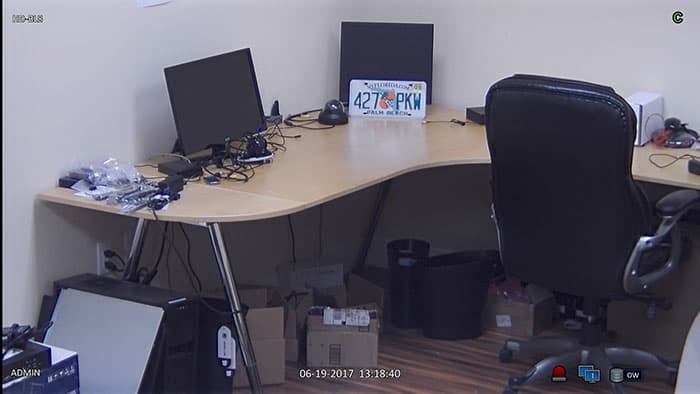
This screenshot has width=700, height=394. Identify the location of desk chair. (578, 256).